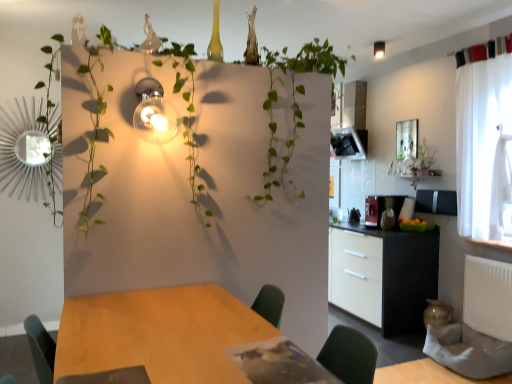
Question: From the image's perspective, relative to black matte cabinet at right, is metallic bulb at upper left, positioned as the second light fixture in right-to-left order, above or below?

Choices:
 (A) below
 (B) above

Answer: (B)

Question: Considering the positions of metallic bulb at upper left, positioned as the second light fixture in right-to-left order, and black matte cabinet at right in the image, is metallic bulb at upper left, positioned as the second light fixture in right-to-left order, wider or thinner than black matte cabinet at right?

Choices:
 (A) thin
 (B) wide

Answer: (A)

Question: Estimate the real-world distances between objects in this image. Which object is farther from the metallic bulb at upper left, positioned as the 1th light fixture in bottom-to-top order?

Choices:
 (A) green leafy plant at center
 (B) matte black coffee machine at center right
 (C) white matte radiator at lower right
 (D) matte glass light fixture at upper right, the first light fixture positioned from the right
 (E) black matte cabinet at right

Answer: (D)

Question: Which object is positioned closest to the matte glass light fixture at upper right, which appears as the 2th light fixture when viewed from the front?

Choices:
 (A) metallic bulb at upper left, positioned as the 1th light fixture in bottom-to-top order
 (B) black matte cabinet at right
 (C) green leafy plant at center
 (D) matte black coffee machine at center right
 (E) white matte radiator at lower right

Answer: (D)